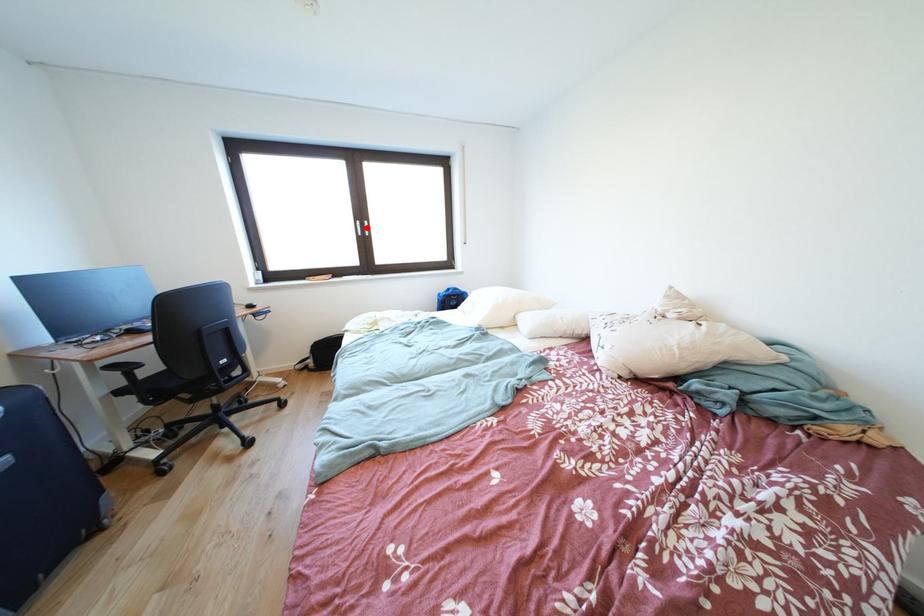
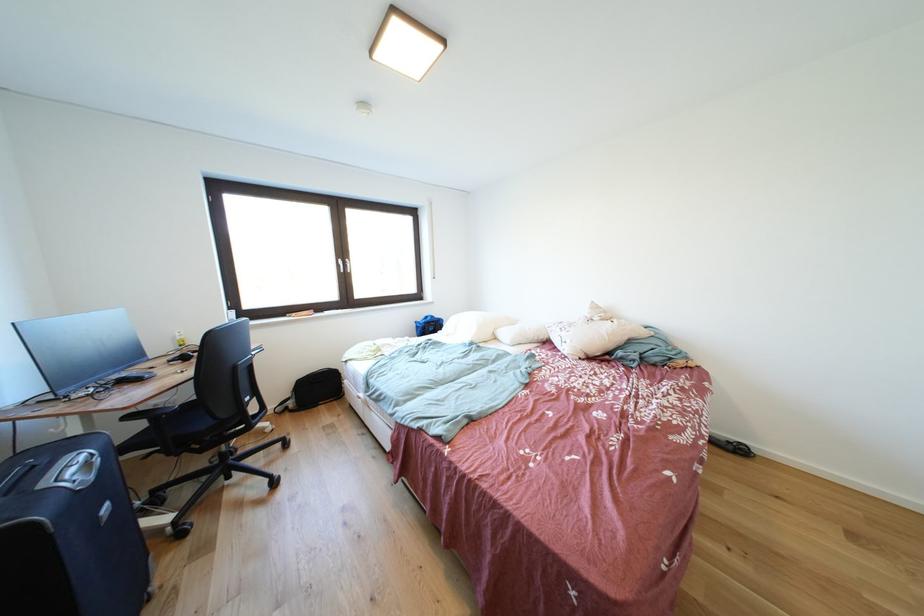
In the second image, find the point that corresponds to the highlighted location in the first image.

(348, 265)